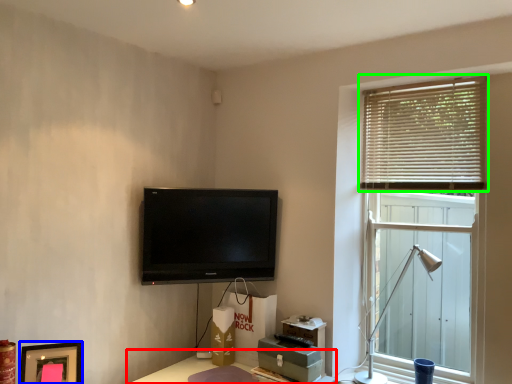
Question: Considering the real-world distances, which object is farthest from table (highlighted by a red box)? picture frame (highlighted by a blue box) or window blind (highlighted by a green box)?

Choices:
 (A) picture frame
 (B) window blind

Answer: (B)